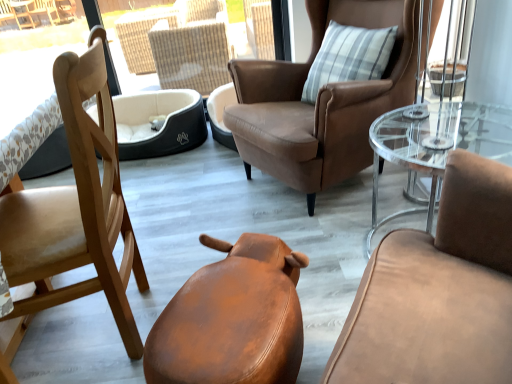
Question: Is clear glass coffee table at right to the left of light brown wood chair at left, which appears as the 1th chair when viewed from the left, from the viewer's perspective?

Choices:
 (A) no
 (B) yes

Answer: (A)

Question: Is light brown wood chair at left, which is counted as the 3th chair, starting from the right, at the back of clear glass coffee table at right?

Choices:
 (A) no
 (B) yes

Answer: (A)

Question: Is clear glass coffee table at right taller than light brown wood chair at left, which is counted as the 3th chair, starting from the right?

Choices:
 (A) yes
 (B) no

Answer: (B)

Question: From a real-world perspective, is clear glass coffee table at right located higher than light brown wood chair at left, which appears as the 1th chair when viewed from the left?

Choices:
 (A) no
 (B) yes

Answer: (A)

Question: From a real-world perspective, is clear glass coffee table at right below light brown wood chair at left, which appears as the 1th chair when viewed from the left?

Choices:
 (A) no
 (B) yes

Answer: (B)

Question: Does clear glass coffee table at right have a larger size compared to light brown wood chair at left, which appears as the 1th chair when viewed from the left?

Choices:
 (A) no
 (B) yes

Answer: (A)

Question: Is light brown wood chair at left, which is counted as the 3th chair, starting from the right, oriented away from leather-like brown stool at lower center, which appears as the 2th chair when viewed from the left?

Choices:
 (A) no
 (B) yes

Answer: (B)

Question: Does light brown wood chair at left, which appears as the 1th chair when viewed from the left, have a lesser width compared to leather-like brown stool at lower center, the second chair from the right?

Choices:
 (A) yes
 (B) no

Answer: (A)

Question: Considering the relative positions of light brown wood chair at left, which appears as the 1th chair when viewed from the left, and leather-like brown stool at lower center, which appears as the 2th chair when viewed from the left, in the image provided, is light brown wood chair at left, which appears as the 1th chair when viewed from the left, in front of leather-like brown stool at lower center, which appears as the 2th chair when viewed from the left,?

Choices:
 (A) no
 (B) yes

Answer: (A)

Question: Is light brown wood chair at left, which appears as the 1th chair when viewed from the left, wider than leather-like brown stool at lower center, which appears as the 2th chair when viewed from the left?

Choices:
 (A) yes
 (B) no

Answer: (B)

Question: Is light brown wood chair at left, which is counted as the 3th chair, starting from the right, not within leather-like brown stool at lower center, which appears as the 2th chair when viewed from the left?

Choices:
 (A) yes
 (B) no

Answer: (A)

Question: Can you confirm if light brown wood chair at left, which is counted as the 3th chair, starting from the right, is positioned to the left of leather-like brown stool at lower center, which appears as the 2th chair when viewed from the left?

Choices:
 (A) no
 (B) yes

Answer: (B)

Question: Is clear glass coffee table at right oriented towards brown leather chair at upper center, which ranks as the 3th chair in left-to-right order?

Choices:
 (A) no
 (B) yes

Answer: (A)